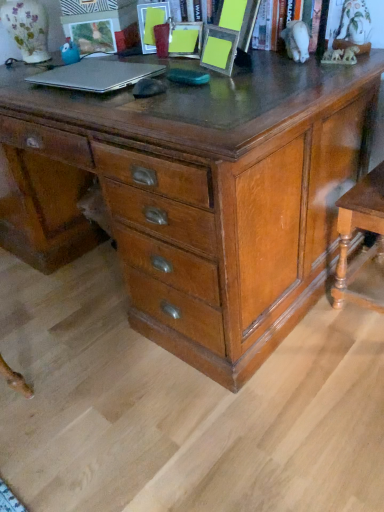
Question: Can you confirm if yellow paper at upper center is smaller than matte plastic picture frame at upper left, positioned as the third picture frame in right-to-left order?

Choices:
 (A) no
 (B) yes

Answer: (A)

Question: Can you confirm if yellow paper at upper center is bigger than matte plastic picture frame at upper left, positioned as the third picture frame in right-to-left order?

Choices:
 (A) yes
 (B) no

Answer: (A)

Question: From a real-world perspective, is yellow paper at upper center on top of matte plastic picture frame at upper left, positioned as the third picture frame in right-to-left order?

Choices:
 (A) yes
 (B) no

Answer: (A)

Question: Would you say matte plastic picture frame at upper left, positioned as the third picture frame in right-to-left order, is part of yellow paper at upper center's contents?

Choices:
 (A) no
 (B) yes

Answer: (A)

Question: Is yellow paper at upper center turned away from matte plastic picture frame at upper left, positioned as the third picture frame in right-to-left order?

Choices:
 (A) no
 (B) yes

Answer: (A)

Question: Is matte plastic picture frame at upper center, which is the second picture frame in right-to-left order, taller or shorter than yellow paper at upper center?

Choices:
 (A) short
 (B) tall

Answer: (A)

Question: Is matte plastic picture frame at upper center, the 2th picture frame when ordered from left to right, in front of or behind yellow paper at upper center in the image?

Choices:
 (A) behind
 (B) front

Answer: (A)

Question: In the image, is matte plastic picture frame at upper center, which is the second picture frame in right-to-left order, on the left side or the right side of yellow paper at upper center?

Choices:
 (A) right
 (B) left

Answer: (B)

Question: From the image's perspective, is matte plastic picture frame at upper center, which is the second picture frame in right-to-left order, above or below yellow paper at upper center?

Choices:
 (A) below
 (B) above

Answer: (B)

Question: From the image's perspective, is shiny brown wooden chest of drawers at center above or below matte plastic picture frame at upper left, positioned as the third picture frame in right-to-left order?

Choices:
 (A) below
 (B) above

Answer: (A)

Question: Considering the positions of point (259, 278) and point (74, 40), is point (259, 278) closer or farther from the camera than point (74, 40)?

Choices:
 (A) closer
 (B) farther

Answer: (A)

Question: Considering their positions, is shiny brown wooden chest of drawers at center located in front of or behind matte plastic picture frame at upper left, positioned as the third picture frame in right-to-left order?

Choices:
 (A) front
 (B) behind

Answer: (A)

Question: Based on their positions, is shiny brown wooden chest of drawers at center located to the left or right of matte plastic picture frame at upper left, positioned as the third picture frame in right-to-left order?

Choices:
 (A) right
 (B) left

Answer: (A)

Question: From a real-world perspective, is matte plastic picture frame at upper center, the 2th picture frame when ordered from left to right, positioned above or below shiny brown wooden chest of drawers at center?

Choices:
 (A) above
 (B) below

Answer: (A)

Question: Would you say matte plastic picture frame at upper center, which is the second picture frame in right-to-left order, is to the left or to the right of shiny brown wooden chest of drawers at center in the picture?

Choices:
 (A) right
 (B) left

Answer: (A)